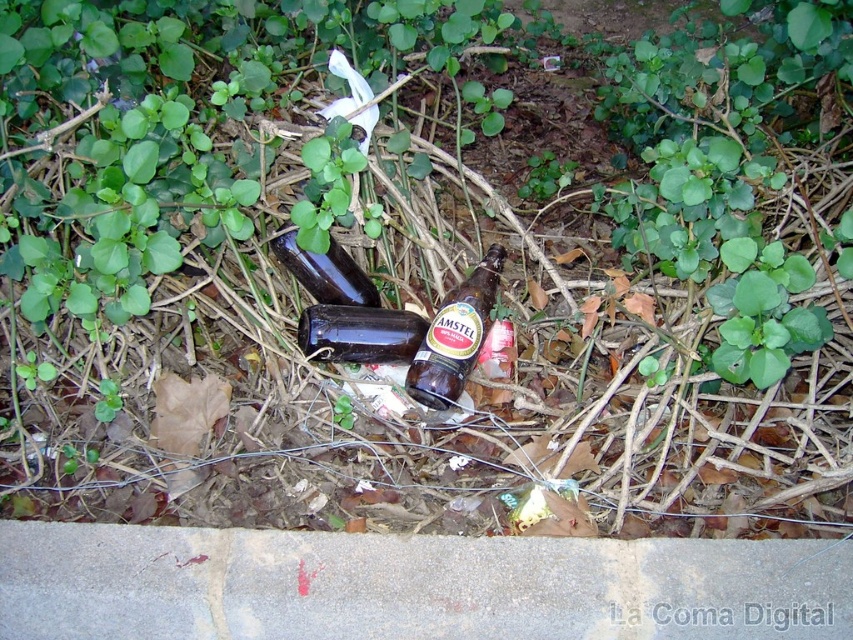
Looking at this image, you are standing on the concrete at lower left and want to pick up the shiny dark brown bottle at center. Can you reach it without moving your feet?

The concrete at lower left is below shiny dark brown bottle at center, so yes, you can reach it without moving your feet since the bottle is positioned above the concrete where you are standing.

You are standing at the center of the scene and want to move to the concrete at lower left. What direction should you move in to reach it?

The concrete at lower left is located at point 0.916 on the x axis and 0.483 on the y axis. Since you are at the center, you should move towards the lower left direction to reach it.

You are a waste collector who needs to determine which bottle to pick up first. The amber glass bottle at center and the dark glass bottle at center are both lying on the ground. Which one has a smaller diameter?

The amber glass bottle at center is thinner than the dark glass bottle at center, so it has a smaller diameter.